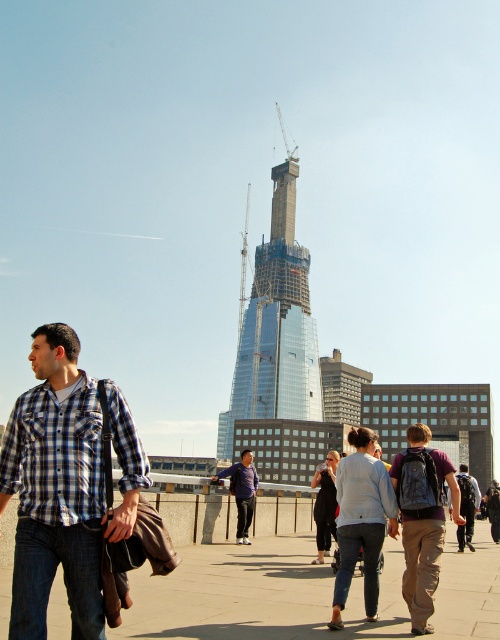
Question: Does plaid cotton shirt at left lie in front of light blue sweater at center?

Choices:
 (A) yes
 (B) no

Answer: (A)

Question: Which point is closer to the camera?

Choices:
 (A) dark blue shirt at center
 (B) light blue sweater at center
 (C) plaid cotton shirt at left
 (D) denim backpack at center right

Answer: (C)

Question: Which point is closer to the camera?

Choices:
 (A) coord(240,410)
 (B) coord(426,548)
 (C) coord(465,518)
 (D) coord(345,579)

Answer: (D)

Question: Among these points, which one is farthest from the camera?

Choices:
 (A) (307, 566)
 (B) (352, 476)
 (C) (79, 436)

Answer: (A)

Question: Observing the image, what is the correct spatial positioning of concrete sidewalk at center in reference to dark gray backpack at center?

Choices:
 (A) right
 (B) left

Answer: (B)

Question: Can you confirm if plaid cotton shirt at left is positioned to the left of denim backpack at center right?

Choices:
 (A) yes
 (B) no

Answer: (A)